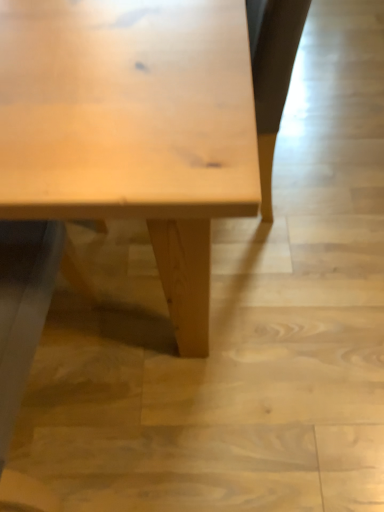
You are a GUI agent. You are given a task and a screenshot of the screen. Output one action in this format:
    pyautogui.click(x=<x>, y=<y>)
    Task: Click on the vacant space to the right of matte wood table at center
    This screenshot has width=384, height=512.
    Given the screenshot: What is the action you would take?
    click(x=261, y=358)